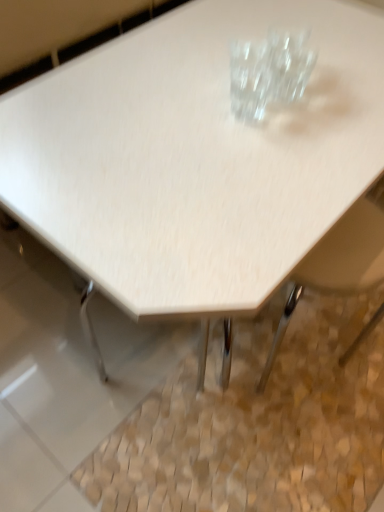
At what (x,y) coordinates should I click in order to perform the action: click on free space to the right of metallic silver chair at lower right. Please return your answer as a coordinate pair (x, y). The height and width of the screenshot is (512, 384). Looking at the image, I should click on (360, 374).